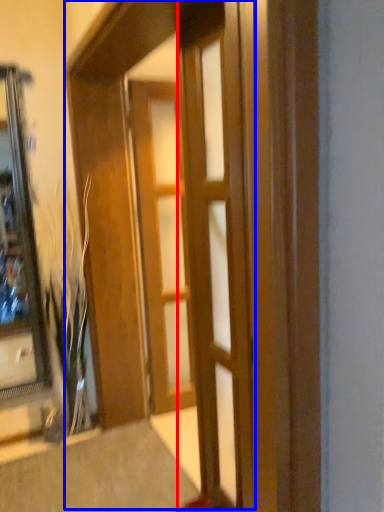
Question: Among these objects, which one is farthest to the camera, door (highlighted by a red box) or barn door (highlighted by a blue box)?

Choices:
 (A) door
 (B) barn door

Answer: (A)